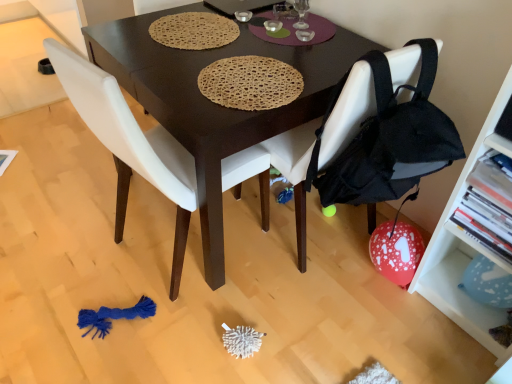
What are the coordinates of `free space in front of black fabric chair at lower right, which is the second chair from left to right` in the screenshot? It's located at coord(314,320).